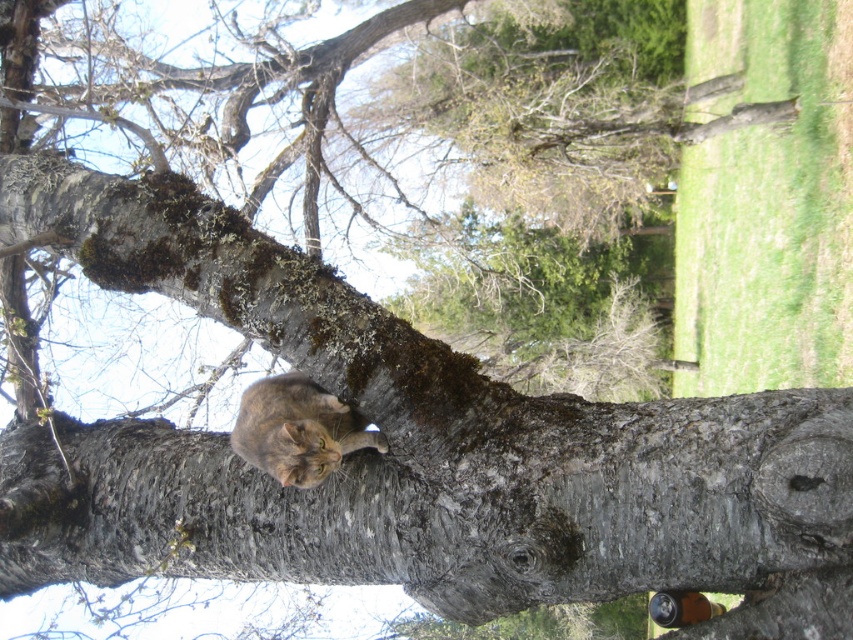
You are a bird flying over the scene and want to land on the smooth gray bark at center. From the perspective of the tabby fur cat at upper center, on which side should you aim to land?

The smooth gray bark at center is to the right of the tabby fur cat at upper center, so you should aim to land on the right side from the cat.

You are a bird flying over the scene and want to land on the smooth gray bark at center. However, there is a tabby fur cat at upper center above it. Will the cat block your landing path?

The smooth gray bark at center is positioned under the tabby fur cat at upper center, so the cat is above the bark. Since you are flying over, the cat would be in your path and block your landing.